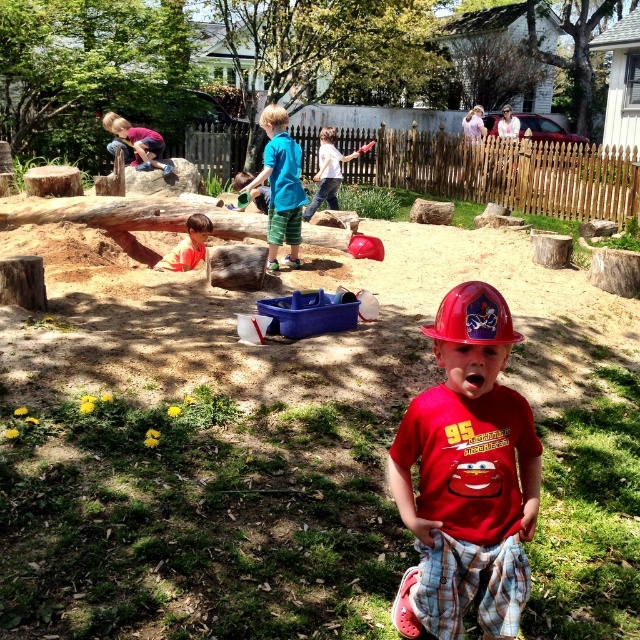
Does white cotton shirt at center have a greater height compared to orange shirt at center?

Correct, white cotton shirt at center is much taller as orange shirt at center.

Who is taller, white cotton shirt at center or orange shirt at center?

Standing taller between the two is white cotton shirt at center.

Identify the location of white cotton shirt at center. The width and height of the screenshot is (640, 640). (326, 172).

Can you confirm if blue cotton shirt at center is taller than red hard hat at center?

Yes, blue cotton shirt at center is taller than red hard hat at center.

Locate an element on the screen. Image resolution: width=640 pixels, height=640 pixels. blue cotton shirt at center is located at coordinates (280, 186).

Who is more distant from viewer, (294, 264) or (179, 253)?

Point (294, 264)

Does point (291, 150) lie behind point (196, 221)?

No, (291, 150) is closer to viewer.

Does point (285, 115) come in front of point (198, 216)?

Yes, it is in front of point (198, 216).

The image size is (640, 640). Find the location of `blue cotton shirt at center`. blue cotton shirt at center is located at coordinates (280, 186).